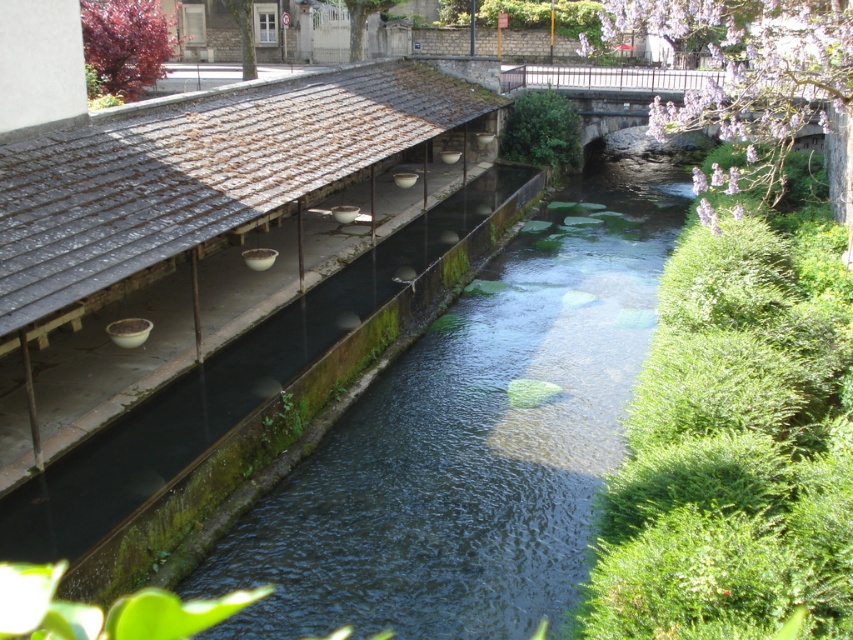
Question: Which point appears closest to the camera in this image?

Choices:
 (A) (53, 509)
 (B) (579, 497)

Answer: (A)

Question: Is green mossy concrete at left further to camera compared to green mossy concrete at center?

Choices:
 (A) no
 (B) yes

Answer: (B)

Question: Can you confirm if green mossy concrete at left is bigger than green mossy concrete at center?

Choices:
 (A) yes
 (B) no

Answer: (A)

Question: Can you confirm if green mossy concrete at left is positioned above green mossy concrete at center?

Choices:
 (A) yes
 (B) no

Answer: (B)